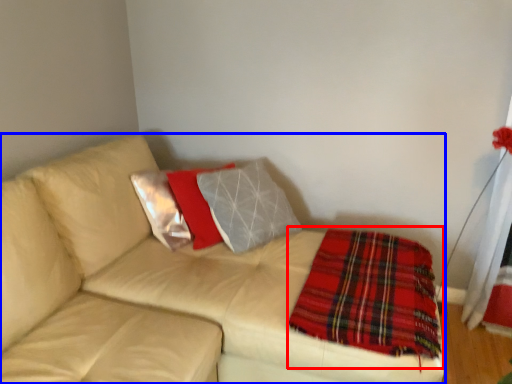
Question: Which of the following is the farthest to the observer, blanket (highlighted by a red box) or studio couch (highlighted by a blue box)?

Choices:
 (A) blanket
 (B) studio couch

Answer: (A)